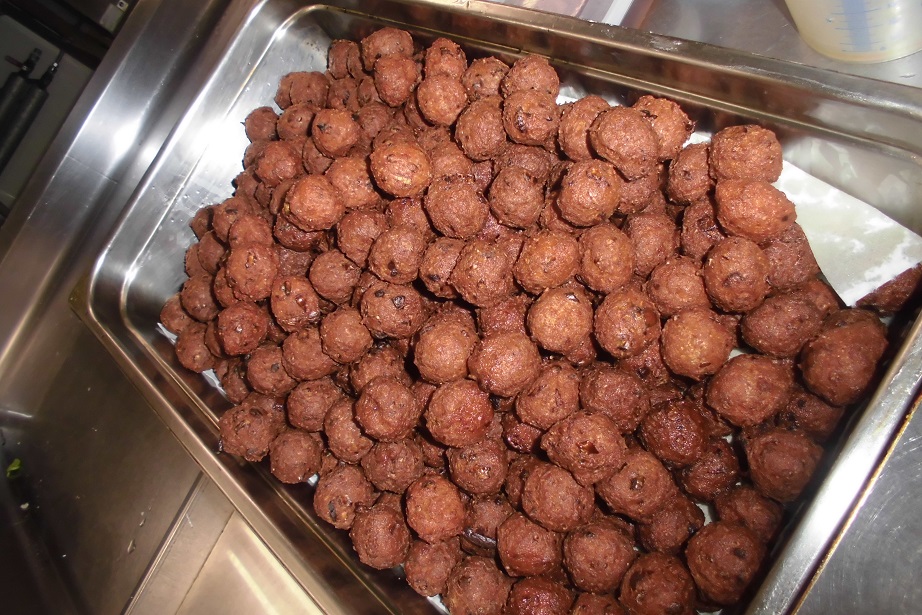
Identify the location of lines on measuring cup. This screenshot has width=922, height=615. (857, 16).